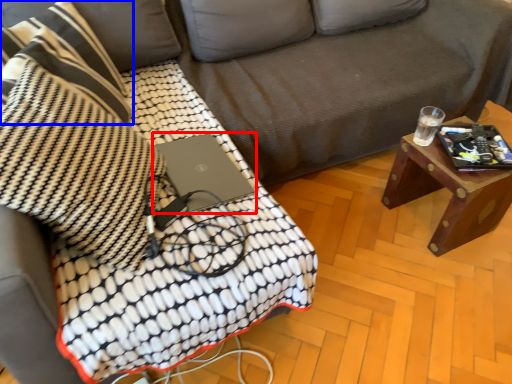
Question: Which of the following is the farthest to the observer, laptop (highlighted by a red box) or throw pillow (highlighted by a blue box)?

Choices:
 (A) laptop
 (B) throw pillow

Answer: (A)